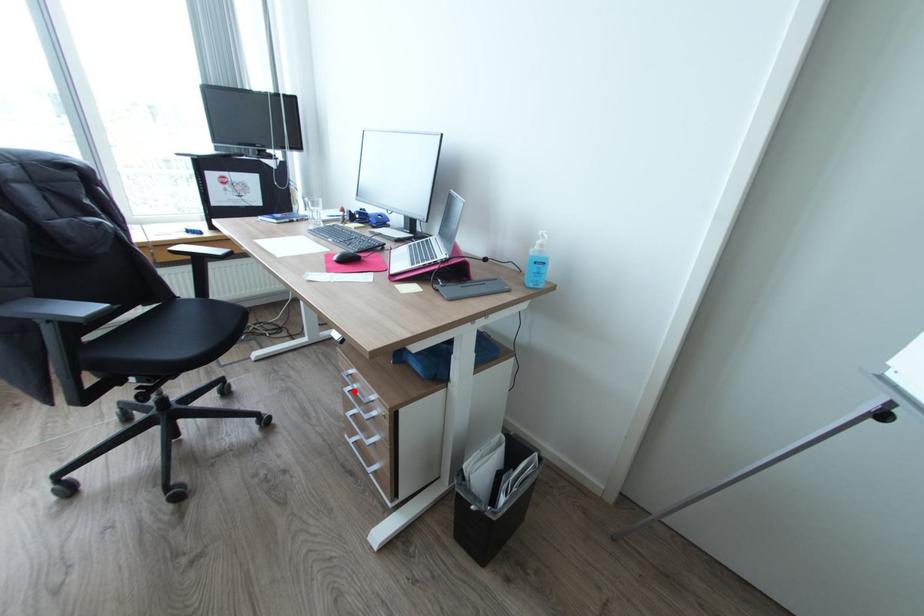
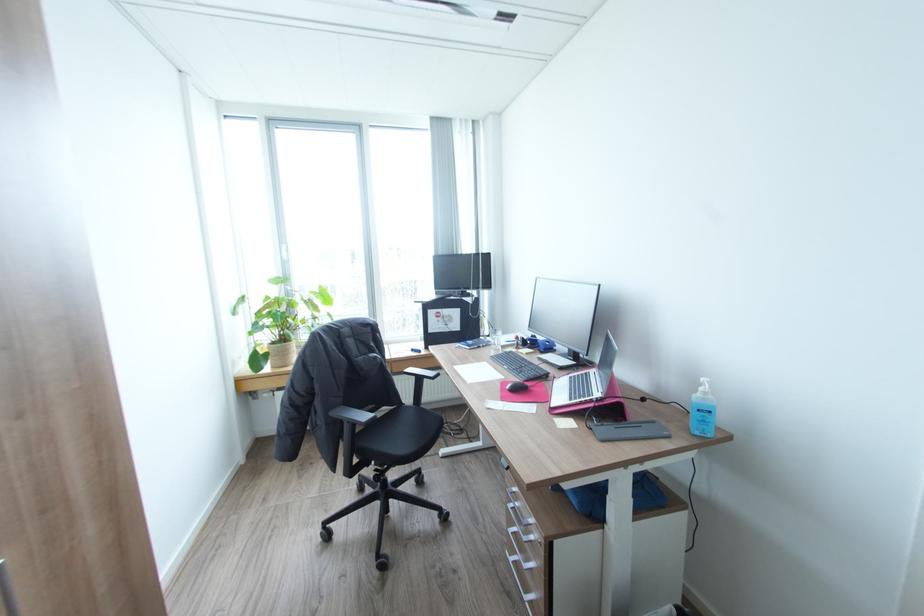
In the second image, find the point that corresponds to the highlighted location in the first image.

(517, 508)